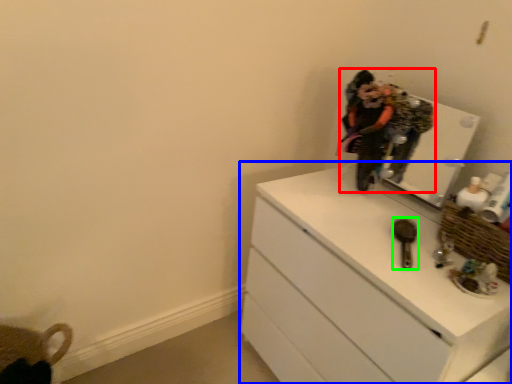
Question: Which object is positioned farthest from person (highlighted by a red box)? Select from chest of drawers (highlighted by a blue box) and brush (highlighted by a green box).

Choices:
 (A) chest of drawers
 (B) brush

Answer: (A)